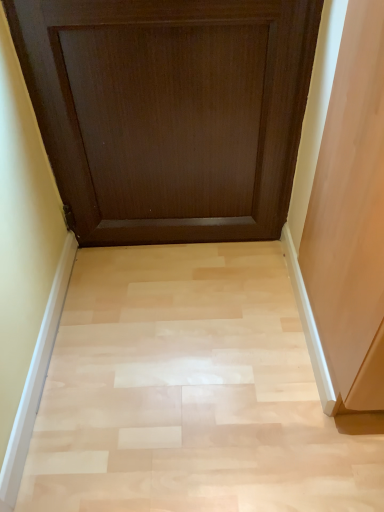
The width and height of the screenshot is (384, 512). Identify the location of free space above light wood floor at center (from a real-world perspective). (205, 349).